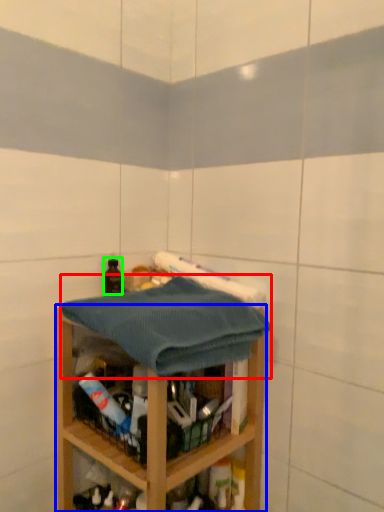
Question: Which is nearer to the bath towel (highlighted by a red box)? shelf (highlighted by a blue box) or bottle (highlighted by a green box).

Choices:
 (A) shelf
 (B) bottle

Answer: (A)